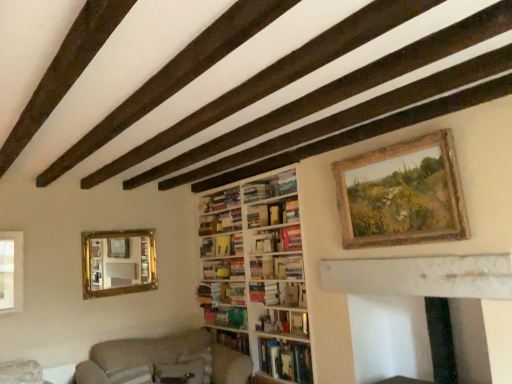
Question: Is green matte book at center, placed as the eighth book when sorted from top to bottom, not inside hardcover book at center, marked as the 9th book in a top-to-bottom arrangement?

Choices:
 (A) yes
 (B) no

Answer: (A)

Question: Does green matte book at center, placed as the eighth book when sorted from top to bottom, come in front of hardcover book at center, the 1th book ordered from the bottom?

Choices:
 (A) yes
 (B) no

Answer: (B)

Question: Is green matte book at center, placed as the eighth book when sorted from top to bottom, bigger than hardcover book at center, the 1th book ordered from the bottom?

Choices:
 (A) yes
 (B) no

Answer: (B)

Question: Is green matte book at center, placed as the eighth book when sorted from top to bottom, to the right of hardcover book at center, marked as the 9th book in a top-to-bottom arrangement, from the viewer's perspective?

Choices:
 (A) no
 (B) yes

Answer: (A)

Question: From the image's perspective, is green matte book at center, acting as the second book starting from the bottom, below hardcover book at center, marked as the 9th book in a top-to-bottom arrangement?

Choices:
 (A) yes
 (B) no

Answer: (B)

Question: Considering the relative sizes of white marble fireplace at lower right and green matte book at center, placed as the eighth book when sorted from top to bottom, in the image provided, is white marble fireplace at lower right shorter than green matte book at center, placed as the eighth book when sorted from top to bottom,?

Choices:
 (A) yes
 (B) no

Answer: (B)

Question: Can you confirm if white marble fireplace at lower right is taller than green matte book at center, placed as the eighth book when sorted from top to bottom?

Choices:
 (A) no
 (B) yes

Answer: (B)

Question: Is white marble fireplace at lower right bigger than green matte book at center, acting as the second book starting from the bottom?

Choices:
 (A) no
 (B) yes

Answer: (B)

Question: Is white marble fireplace at lower right with green matte book at center, placed as the eighth book when sorted from top to bottom?

Choices:
 (A) yes
 (B) no

Answer: (B)

Question: Can you confirm if white marble fireplace at lower right is thinner than green matte book at center, placed as the eighth book when sorted from top to bottom?

Choices:
 (A) yes
 (B) no

Answer: (B)

Question: Does white marble fireplace at lower right have a greater width compared to green matte book at center, placed as the eighth book when sorted from top to bottom?

Choices:
 (A) yes
 (B) no

Answer: (A)

Question: Is beige fabric couch at lower left bigger than wooden bookshelf at center?

Choices:
 (A) yes
 (B) no

Answer: (A)